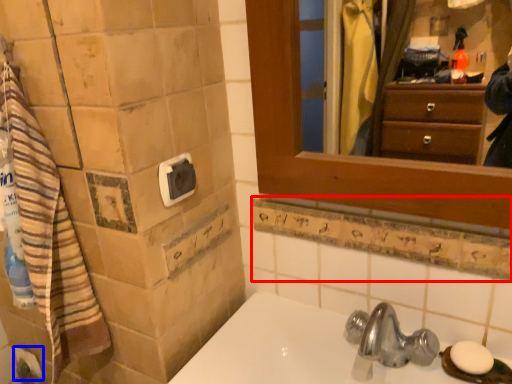
Question: Among these objects, which one is nearest to the camera, ledge (highlighted by a red box) or toilet paper (highlighted by a blue box)?

Choices:
 (A) ledge
 (B) toilet paper

Answer: (A)